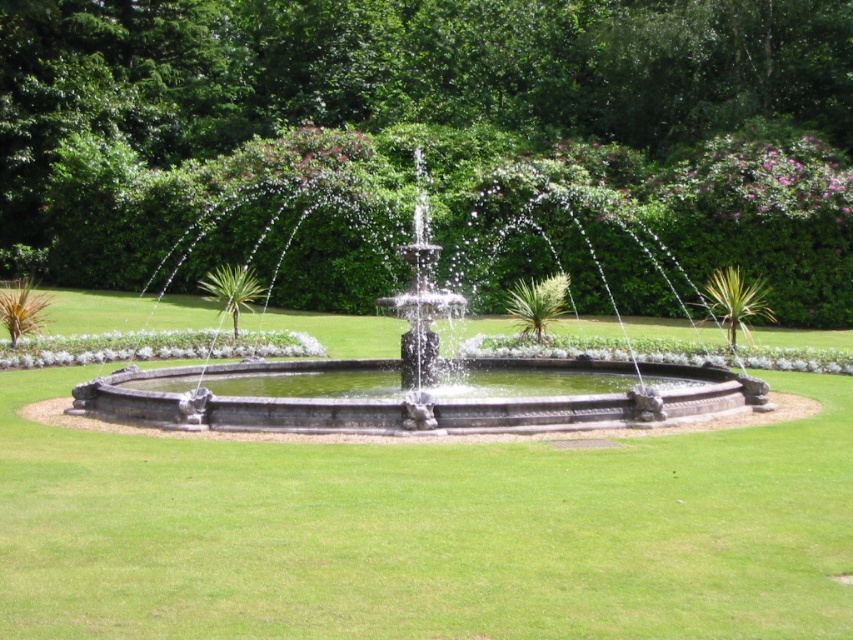
Who is lower down, green grass at center or stone fountain at center?

green grass at center is below.

Between point (300, 477) and point (434, 417), which one is positioned in front?

Point (300, 477)

This screenshot has width=853, height=640. What are the coordinates of `green grass at center` in the screenshot? It's located at (425, 531).

Which is more to the right, green leafy tree at center or stone fountain at center?

stone fountain at center is more to the right.

Does green leafy tree at center appear over stone fountain at center?

Yes.

What are the coordinates of `green leafy tree at center` in the screenshot? It's located at (430, 141).

Who is positioned more to the left, green leafy tree at center or green grass at center?

green leafy tree at center is more to the left.

This screenshot has width=853, height=640. In order to click on green leafy tree at center in this screenshot , I will do `click(430, 141)`.

Does point (698, 83) come behind point (695, 540)?

That is True.

I want to click on green leafy tree at center, so tap(430, 141).